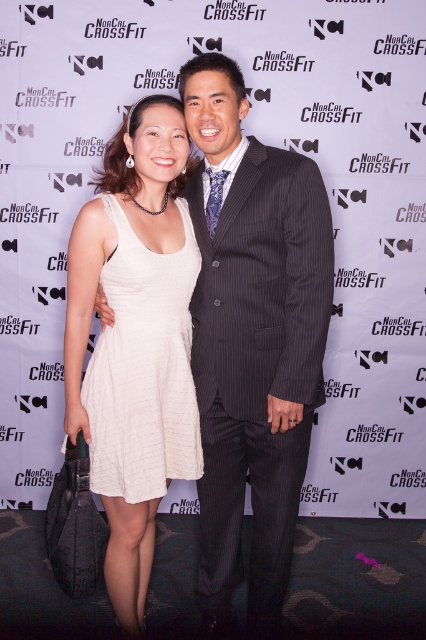
You are a photographer at a NorCal CrossFit event and notice two dresses at the center of your frame. Which dress is positioned higher between the white satin dress at center and the white knit dress at center?

The white satin dress at center is positioned higher than the white knit dress at center according to the description.

You are a photographer at the NorCal CrossFit event and notice two dresses at the center of the image. Which dress is positioned closer to you, the white satin dress at center or the white knit dress at center?

The white satin dress at center is closer to the viewer than the white knit dress at center.